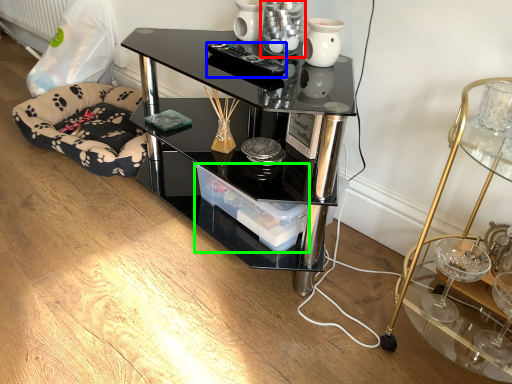
Question: Which object is the closest to the candle holder (highlighted by a red box)? Choose among these: remote control (highlighted by a blue box) or glass box (highlighted by a green box).

Choices:
 (A) remote control
 (B) glass box

Answer: (A)